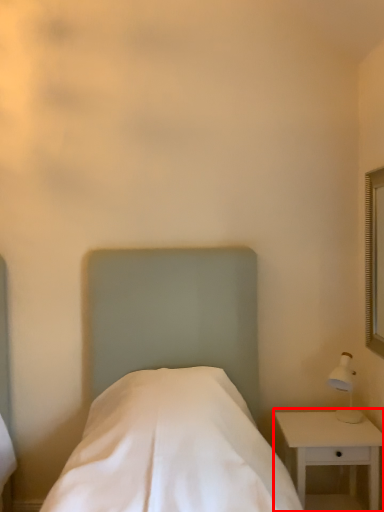
Question: From the image's perspective, what is the correct spatial positioning of nightstand (annotated by the red box) in reference to bed?

Choices:
 (A) above
 (B) below

Answer: (B)